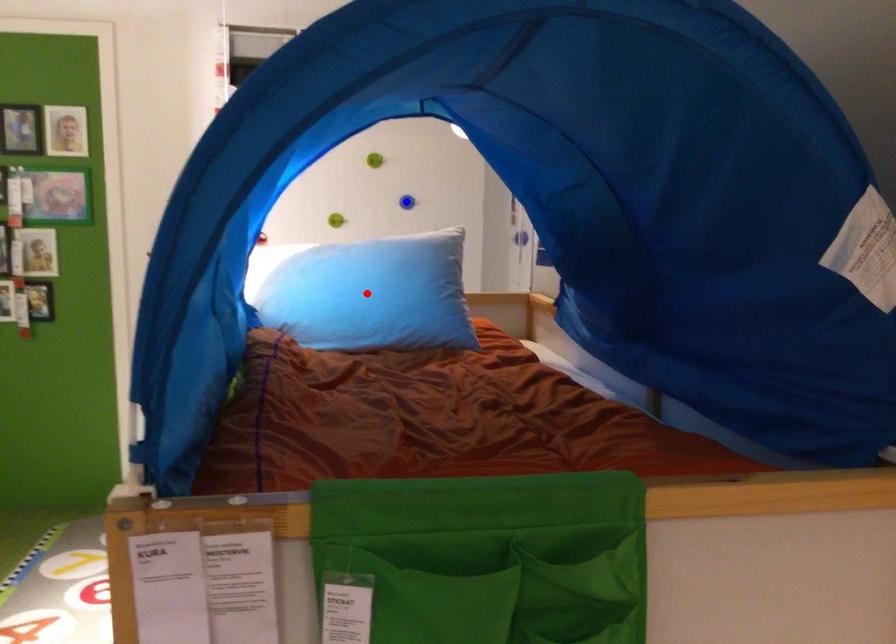
Question: In the image, two points are highlighted. Which point is nearer to the camera? Reply with the corresponding letter.

Choices:
 (A) blue point
 (B) red point

Answer: (B)